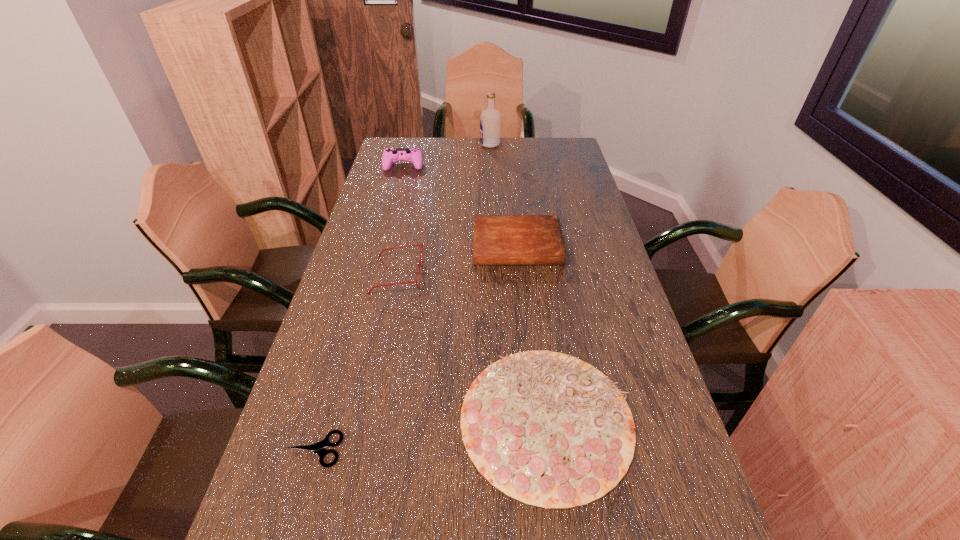
Where is `free space located 0.210m on the front of the control`? This screenshot has width=960, height=540. free space located 0.210m on the front of the control is located at coordinates (395, 201).

This screenshot has height=540, width=960. I want to click on free region located on the face of the spectacles, so click(x=459, y=275).

You are a GUI agent. You are given a task and a screenshot of the screen. Output one action in this format:
    pyautogui.click(x=<x>, y=<y>)
    Task: Click on the free spot located 0.400m on the spine side of the Bible
    This screenshot has height=540, width=960.
    Given the screenshot: What is the action you would take?
    pyautogui.click(x=531, y=379)

I want to click on vacant space located 0.390m on the back of the pizza, so coord(526,252).

Locate an element on the screen. The image size is (960, 540). free space located on the back of the shortest object is located at coordinates (348, 331).

This screenshot has height=540, width=960. Identify the location of vodka at the far edge. (490, 119).

Where is `control positioned at the far edge`? Image resolution: width=960 pixels, height=540 pixels. control positioned at the far edge is located at coordinates (414, 155).

Identify the location of control that is positioned at the left edge. (414, 155).

Image resolution: width=960 pixels, height=540 pixels. Find the location of `spectacles located in the left edge section of the desktop`. spectacles located in the left edge section of the desktop is located at coordinates (421, 244).

I want to click on shears located in the left edge section of the desktop, so click(318, 448).